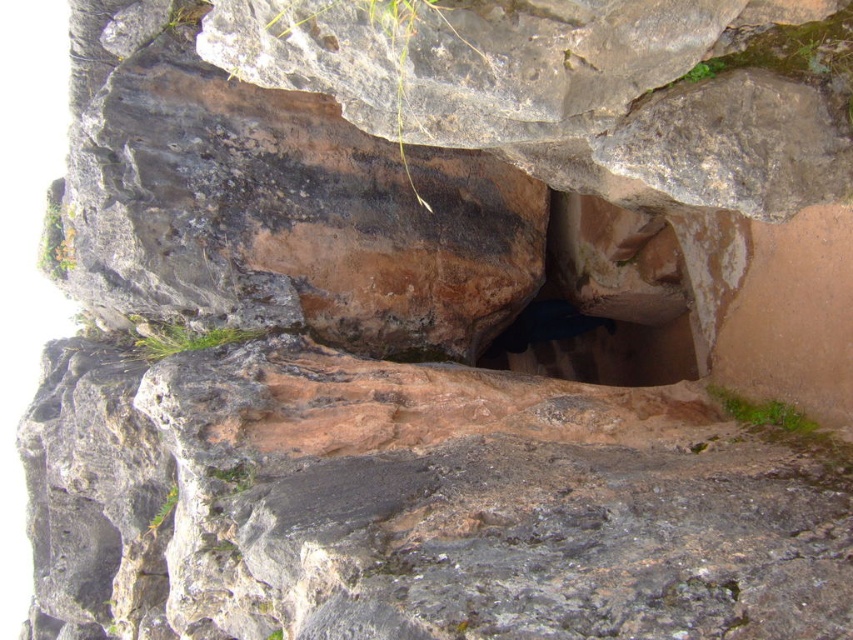
Does brown stone staircase at center have a lesser height compared to dark brown stone hole at center?

No.

Is brown stone staircase at center behind dark brown stone hole at center?

No, it is in front of dark brown stone hole at center.

Measure the distance between brown stone staircase at center and camera.

2.91 meters

The width and height of the screenshot is (853, 640). I want to click on brown stone staircase at center, so click(x=614, y=296).